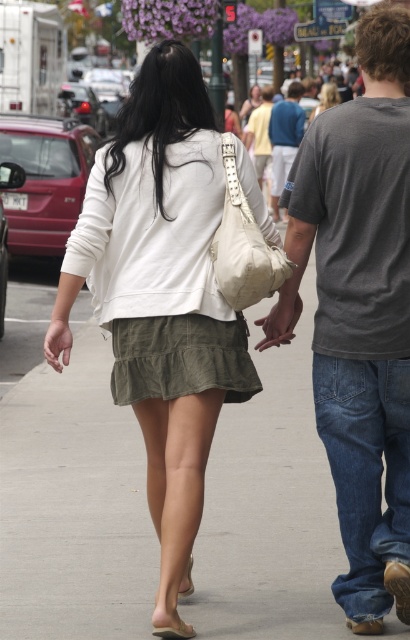
Question: Based on their relative distances, which object is farther from the dark gray t-shirt at center?

Choices:
 (A) light beige fabric pants at center
 (B) green fabric skirt at center
 (C) matte black hand at center
 (D) white cotton jacket at center

Answer: (A)

Question: Which point appears closest to the camera in this image?

Choices:
 (A) (59, 452)
 (B) (328, 106)

Answer: (A)

Question: Does light beige fabric pants at center have a greater width compared to matte black hand at center?

Choices:
 (A) yes
 (B) no

Answer: (A)

Question: Is green fabric skirt at center to the right of dark gray t-shirt at center from the viewer's perspective?

Choices:
 (A) no
 (B) yes

Answer: (A)

Question: Which object is the farthest from the matte white jacket at center?

Choices:
 (A) blue cotton shirt at center
 (B) beige fabric bag at center
 (C) green fabric skirt at center
 (D) light beige fabric pants at center

Answer: (B)

Question: Where is white cotton jacket at center located in relation to matte white jacket at center in the image?

Choices:
 (A) right
 (B) left

Answer: (B)